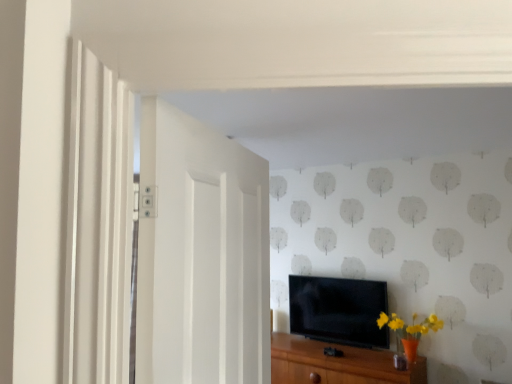
Question: Considering the relative sizes of black glossy tv at center and brown wood cabinet at lower center in the image provided, is black glossy tv at center taller than brown wood cabinet at lower center?

Choices:
 (A) yes
 (B) no

Answer: (A)

Question: Is the position of black glossy tv at center more distant than that of brown wood cabinet at lower center?

Choices:
 (A) no
 (B) yes

Answer: (B)

Question: Is black glossy tv at center to the left of brown wood cabinet at lower center from the viewer's perspective?

Choices:
 (A) no
 (B) yes

Answer: (A)

Question: Can we say black glossy tv at center lies outside brown wood cabinet at lower center?

Choices:
 (A) no
 (B) yes

Answer: (B)

Question: From the image's perspective, is black glossy tv at center beneath brown wood cabinet at lower center?

Choices:
 (A) yes
 (B) no

Answer: (B)

Question: Is black glossy tv at center thinner than brown wood cabinet at lower center?

Choices:
 (A) no
 (B) yes

Answer: (B)

Question: Is black glossy tv at center located outside white painted wood door at left?

Choices:
 (A) no
 (B) yes

Answer: (B)

Question: Can you confirm if black glossy tv at center is positioned to the left of white painted wood door at left?

Choices:
 (A) yes
 (B) no

Answer: (B)

Question: Does black glossy tv at center have a greater height compared to white painted wood door at left?

Choices:
 (A) no
 (B) yes

Answer: (A)

Question: From the image's perspective, would you say black glossy tv at center is shown under white painted wood door at left?

Choices:
 (A) yes
 (B) no

Answer: (A)

Question: Is black glossy tv at center further to camera compared to white painted wood door at left?

Choices:
 (A) no
 (B) yes

Answer: (B)

Question: From a real-world perspective, is black glossy tv at center beneath white painted wood door at left?

Choices:
 (A) no
 (B) yes

Answer: (B)

Question: Is white painted wood door at left shorter than brown wood cabinet at lower center?

Choices:
 (A) yes
 (B) no

Answer: (B)